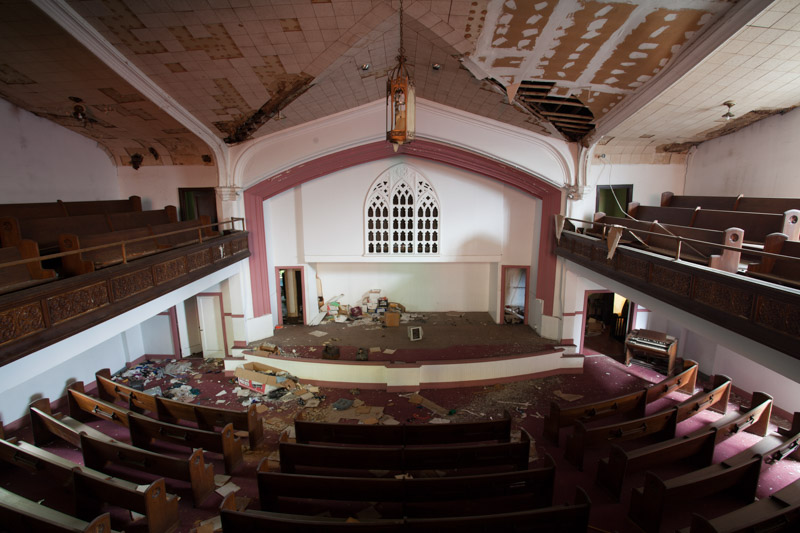
I want to click on light, so coord(412,114).